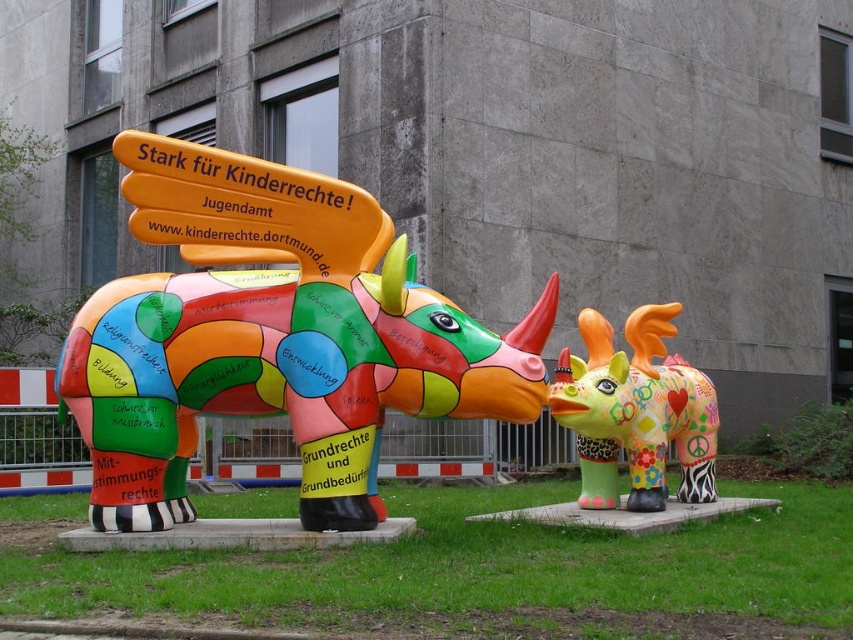
Question: Considering the relative positions of green grass at lower center and multicolored painted rhino at center in the image provided, where is green grass at lower center located with respect to multicolored painted rhino at center?

Choices:
 (A) below
 (B) above

Answer: (A)

Question: Does multicolored painted rhinoceros at center appear on the left side of green grass at lower center?

Choices:
 (A) no
 (B) yes

Answer: (B)

Question: Observing the image, what is the correct spatial positioning of multicolored painted rhinoceros at center in reference to green grass at lower center?

Choices:
 (A) below
 (B) above

Answer: (B)

Question: Which point is farther from the camera taking this photo?

Choices:
 (A) coord(434,323)
 (B) coord(111,595)

Answer: (A)

Question: Estimate the real-world distances between objects in this image. Which object is farther from the green grass at lower center?

Choices:
 (A) multicolored painted rhinoceros at center
 (B) multicolored painted rhino at center

Answer: (B)

Question: Which object is positioned closest to the multicolored painted rhino at center?

Choices:
 (A) multicolored painted rhinoceros at center
 (B) green grass at lower center

Answer: (A)